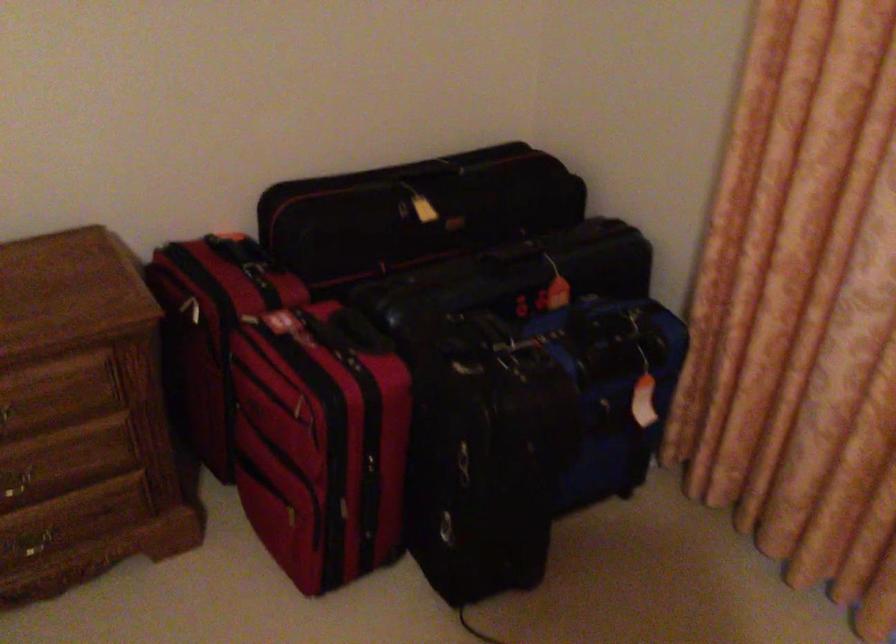
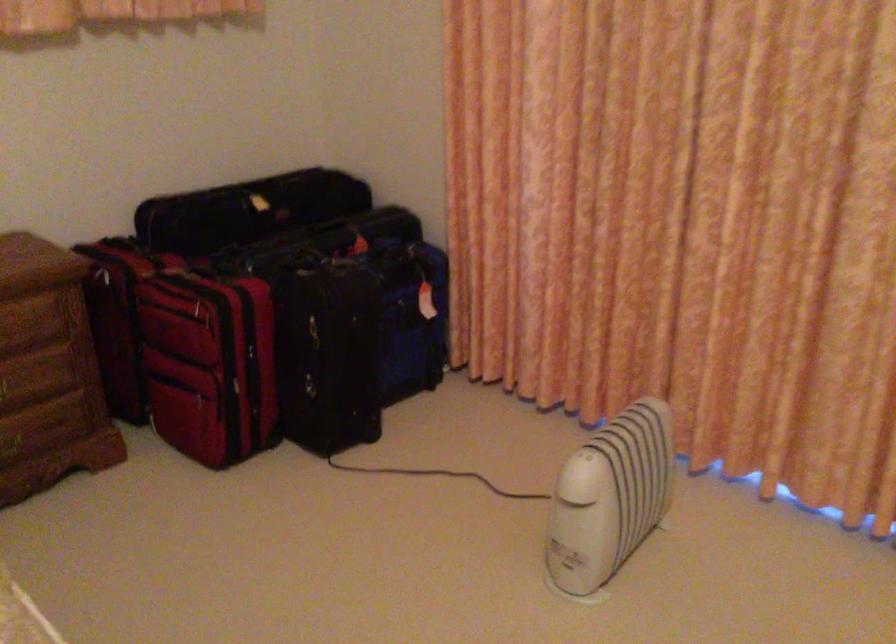
Find the pixel in the second image that matches point 366,381 in the first image.

(243, 292)